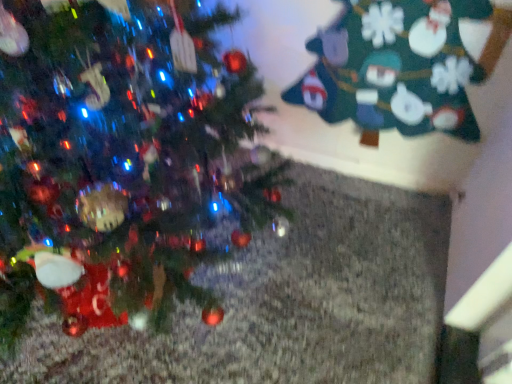
Question: Would you say green felt christmas tree at upper right, which is the 2th christmas tree from left to right, is part of green matte christmas tree at left, the 1th christmas tree when ordered from left to right,'s contents?

Choices:
 (A) no
 (B) yes

Answer: (A)

Question: Is green matte christmas tree at left, the 2th christmas tree viewed from the right, not near green felt christmas tree at upper right, which appears as the 1th christmas tree when viewed from the right?

Choices:
 (A) yes
 (B) no

Answer: (B)

Question: Considering the relative sizes of green matte christmas tree at left, the 2th christmas tree viewed from the right, and green felt christmas tree at upper right, which appears as the 1th christmas tree when viewed from the right, in the image provided, is green matte christmas tree at left, the 2th christmas tree viewed from the right, taller than green felt christmas tree at upper right, which appears as the 1th christmas tree when viewed from the right,?

Choices:
 (A) no
 (B) yes

Answer: (B)

Question: From a real-world perspective, is green matte christmas tree at left, the 1th christmas tree when ordered from left to right, below green felt christmas tree at upper right, which is the 2th christmas tree from left to right?

Choices:
 (A) no
 (B) yes

Answer: (A)

Question: From the image's perspective, would you say green matte christmas tree at left, the 1th christmas tree when ordered from left to right, is positioned over green felt christmas tree at upper right, which is the 2th christmas tree from left to right?

Choices:
 (A) yes
 (B) no

Answer: (B)

Question: Is green matte christmas tree at left, the 2th christmas tree viewed from the right, facing towards green felt christmas tree at upper right, which appears as the 1th christmas tree when viewed from the right?

Choices:
 (A) no
 (B) yes

Answer: (A)

Question: Is green felt christmas tree at upper right, which is the 2th christmas tree from left to right, shorter than green matte christmas tree at left, the 2th christmas tree viewed from the right?

Choices:
 (A) no
 (B) yes

Answer: (B)

Question: Is green felt christmas tree at upper right, which is the 2th christmas tree from left to right, positioned with its back to green matte christmas tree at left, the 2th christmas tree viewed from the right?

Choices:
 (A) no
 (B) yes

Answer: (A)

Question: Does green felt christmas tree at upper right, which is the 2th christmas tree from left to right, turn towards green matte christmas tree at left, the 1th christmas tree when ordered from left to right?

Choices:
 (A) yes
 (B) no

Answer: (B)

Question: Is green felt christmas tree at upper right, which is the 2th christmas tree from left to right, with green matte christmas tree at left, the 1th christmas tree when ordered from left to right?

Choices:
 (A) no
 (B) yes

Answer: (A)

Question: Is green felt christmas tree at upper right, which appears as the 1th christmas tree when viewed from the right, taller than green matte christmas tree at left, the 1th christmas tree when ordered from left to right?

Choices:
 (A) yes
 (B) no

Answer: (B)

Question: From the image's perspective, would you say green felt christmas tree at upper right, which appears as the 1th christmas tree when viewed from the right, is shown under green matte christmas tree at left, the 2th christmas tree viewed from the right?

Choices:
 (A) no
 (B) yes

Answer: (A)

Question: Looking at the image, does green felt christmas tree at upper right, which is the 2th christmas tree from left to right, seem bigger or smaller compared to green matte christmas tree at left, the 2th christmas tree viewed from the right?

Choices:
 (A) small
 (B) big

Answer: (A)